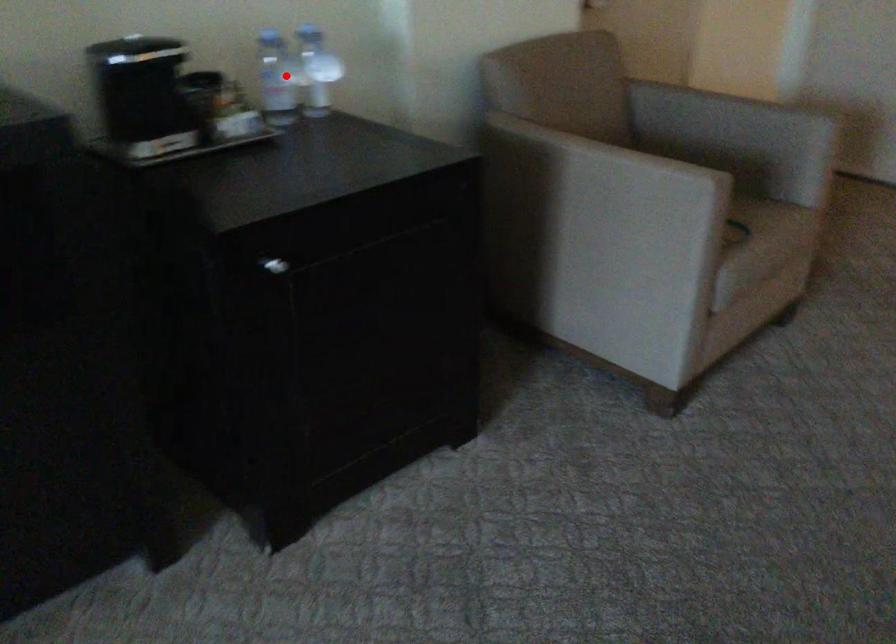
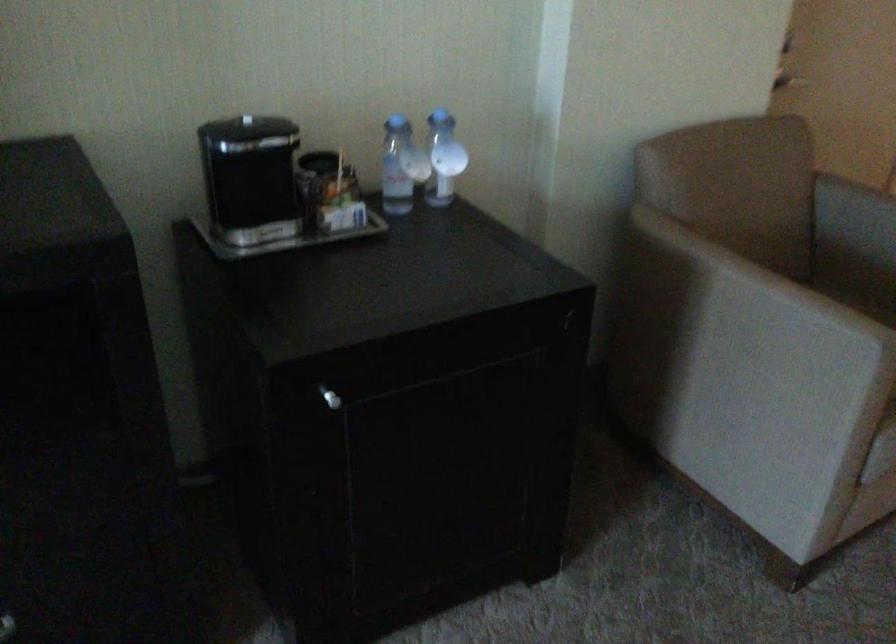
In the second image, find the point that corresponds to the highlighted location in the first image.

(401, 166)